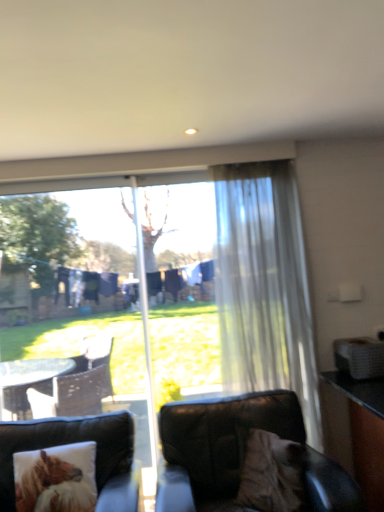
Question: From the image's perspective, is translucent white curtain at right located above leather couch at lower left?

Choices:
 (A) yes
 (B) no

Answer: (A)

Question: Does translucent white curtain at right touch leather couch at lower left?

Choices:
 (A) yes
 (B) no

Answer: (B)

Question: From the image's perspective, is translucent white curtain at right below leather couch at lower left?

Choices:
 (A) no
 (B) yes

Answer: (A)

Question: Does translucent white curtain at right appear on the left side of leather couch at lower left?

Choices:
 (A) no
 (B) yes

Answer: (A)

Question: Is translucent white curtain at right thinner than leather couch at lower left?

Choices:
 (A) yes
 (B) no

Answer: (A)

Question: Considering the relative sizes of translucent white curtain at right and leather couch at lower left in the image provided, is translucent white curtain at right bigger than leather couch at lower left?

Choices:
 (A) no
 (B) yes

Answer: (A)

Question: Is translucent white curtain at right turned away from black leather chair at lower right?

Choices:
 (A) no
 (B) yes

Answer: (A)

Question: Is translucent white curtain at right not inside black leather chair at lower right?

Choices:
 (A) yes
 (B) no

Answer: (A)

Question: Is translucent white curtain at right taller than black leather chair at lower right?

Choices:
 (A) no
 (B) yes

Answer: (B)

Question: From a real-world perspective, is translucent white curtain at right positioned over black leather chair at lower right based on gravity?

Choices:
 (A) no
 (B) yes

Answer: (B)

Question: Is translucent white curtain at right oriented towards black leather chair at lower right?

Choices:
 (A) yes
 (B) no

Answer: (A)

Question: Can you confirm if translucent white curtain at right is shorter than black leather chair at lower right?

Choices:
 (A) no
 (B) yes

Answer: (A)

Question: From the image's perspective, is translucent white curtain at right beneath fluffy brown pillow at lower left?

Choices:
 (A) yes
 (B) no

Answer: (B)